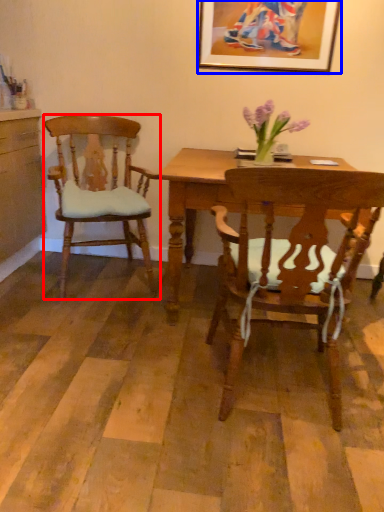
Question: Among these objects, which one is farthest to the camera, chair (highlighted by a red box) or picture frame (highlighted by a blue box)?

Choices:
 (A) chair
 (B) picture frame

Answer: (B)